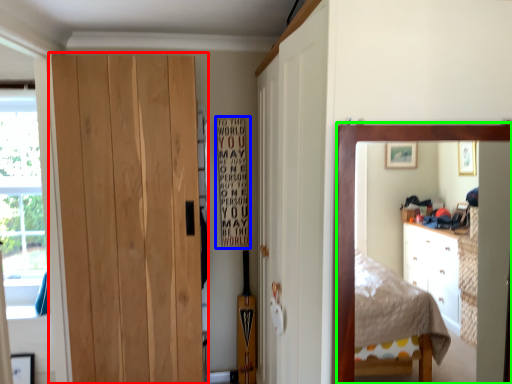
Question: Which object is the farthest from door (highlighted by a red box)? Choose among these: bulletin board (highlighted by a blue box) or mirror (highlighted by a green box).

Choices:
 (A) bulletin board
 (B) mirror

Answer: (B)